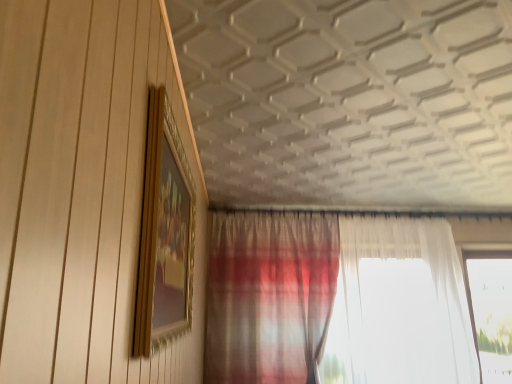
Question: Does gold/gilded picture frame at upper left have a smaller size compared to transparent glass window at right?

Choices:
 (A) yes
 (B) no

Answer: (A)

Question: Is gold/gilded picture frame at upper left to the left of transparent glass window at right from the viewer's perspective?

Choices:
 (A) yes
 (B) no

Answer: (A)

Question: Does gold/gilded picture frame at upper left have a greater width compared to transparent glass window at right?

Choices:
 (A) yes
 (B) no

Answer: (B)

Question: Is gold/gilded picture frame at upper left facing away from transparent glass window at right?

Choices:
 (A) yes
 (B) no

Answer: (B)

Question: From the image's perspective, would you say gold/gilded picture frame at upper left is shown under transparent glass window at right?

Choices:
 (A) yes
 (B) no

Answer: (B)

Question: Is gold/gilded picture frame at upper left taller than transparent glass window at right?

Choices:
 (A) yes
 (B) no

Answer: (B)

Question: From the image's perspective, is plaid fabric curtain at lower center under gold/gilded picture frame at upper left?

Choices:
 (A) no
 (B) yes

Answer: (B)

Question: Can you confirm if plaid fabric curtain at lower center is taller than gold/gilded picture frame at upper left?

Choices:
 (A) no
 (B) yes

Answer: (B)

Question: Considering the relative sizes of plaid fabric curtain at lower center and gold/gilded picture frame at upper left in the image provided, is plaid fabric curtain at lower center smaller than gold/gilded picture frame at upper left?

Choices:
 (A) no
 (B) yes

Answer: (A)

Question: Can you confirm if plaid fabric curtain at lower center is wider than gold/gilded picture frame at upper left?

Choices:
 (A) no
 (B) yes

Answer: (B)

Question: Is plaid fabric curtain at lower center to the left of gold/gilded picture frame at upper left from the viewer's perspective?

Choices:
 (A) no
 (B) yes

Answer: (A)

Question: From a real-world perspective, is plaid fabric curtain at lower center beneath gold/gilded picture frame at upper left?

Choices:
 (A) yes
 (B) no

Answer: (A)

Question: Is transparent glass window at right closer to camera compared to plaid fabric curtain at lower center?

Choices:
 (A) no
 (B) yes

Answer: (A)